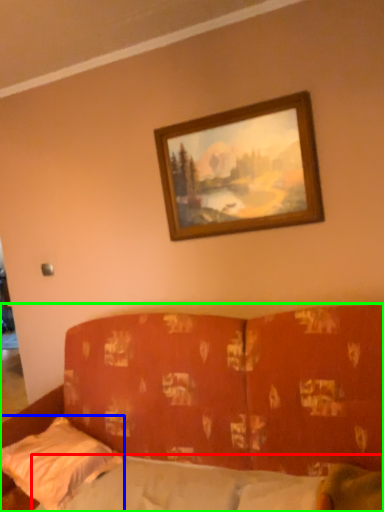
Question: Which object is the closest to the mattress (highlighted by a red box)? Choose among these: pillow (highlighted by a blue box) or studio couch (highlighted by a green box).

Choices:
 (A) pillow
 (B) studio couch

Answer: (A)